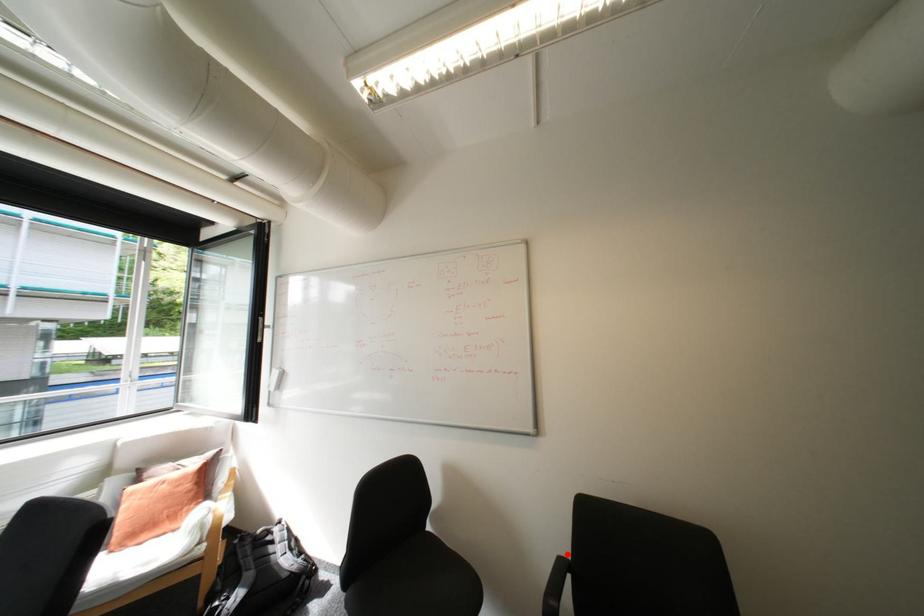
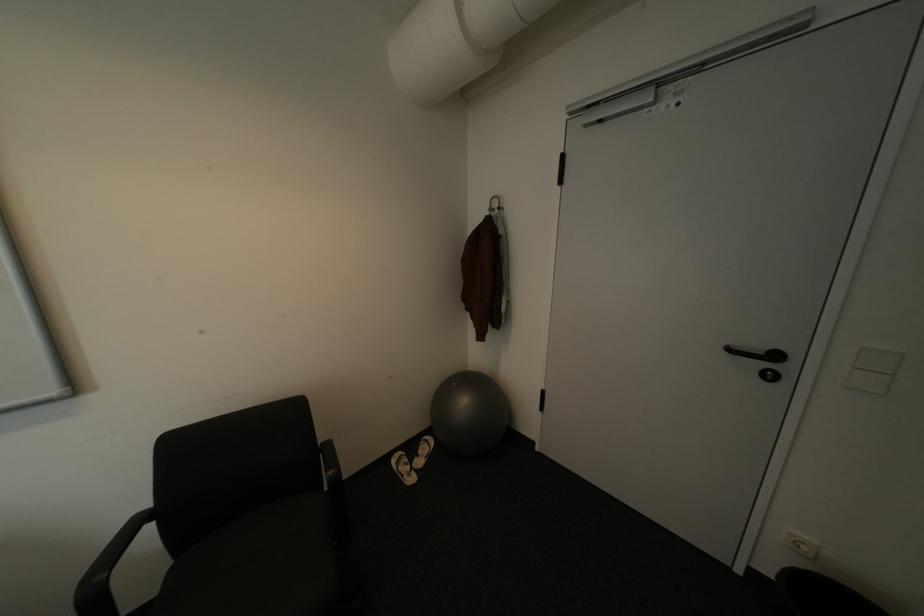
Locate, in the second image, the point that corresponds to the highlighted location in the first image.

(142, 515)